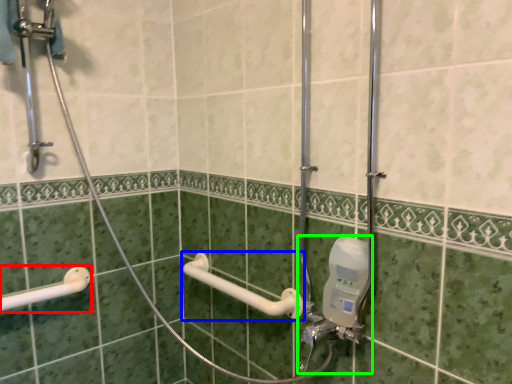
Question: Which is farther away from shower (highlighted by a red box)? towel bar (highlighted by a blue box) or plumbing fixture (highlighted by a green box)?

Choices:
 (A) towel bar
 (B) plumbing fixture

Answer: (B)